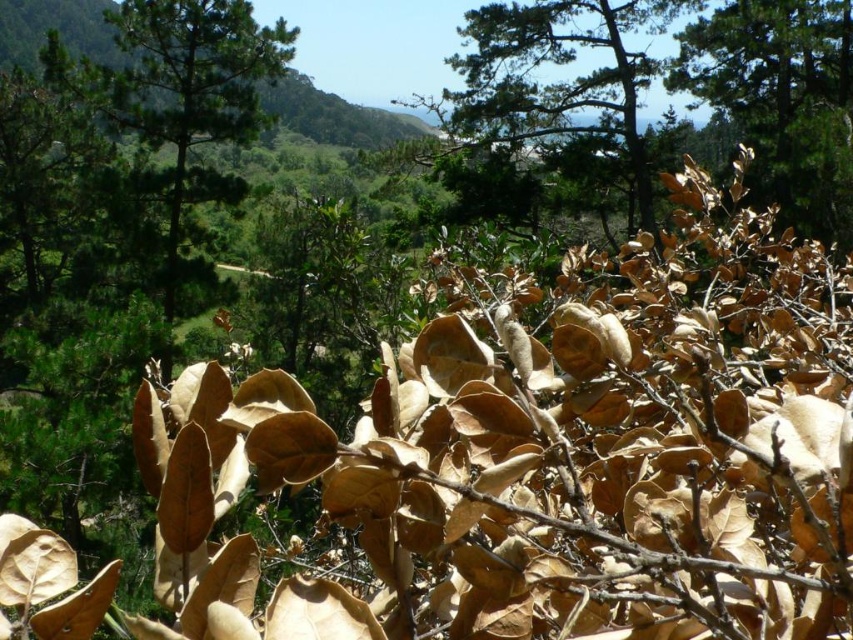
Can you confirm if green textured pine tree at upper center is positioned to the left of brown matte leaves at upper right?

Yes, green textured pine tree at upper center is to the left of brown matte leaves at upper right.

Where is `green textured pine tree at upper center`? green textured pine tree at upper center is located at coordinates (548, 115).

This screenshot has width=853, height=640. I want to click on green textured pine tree at upper center, so click(548, 115).